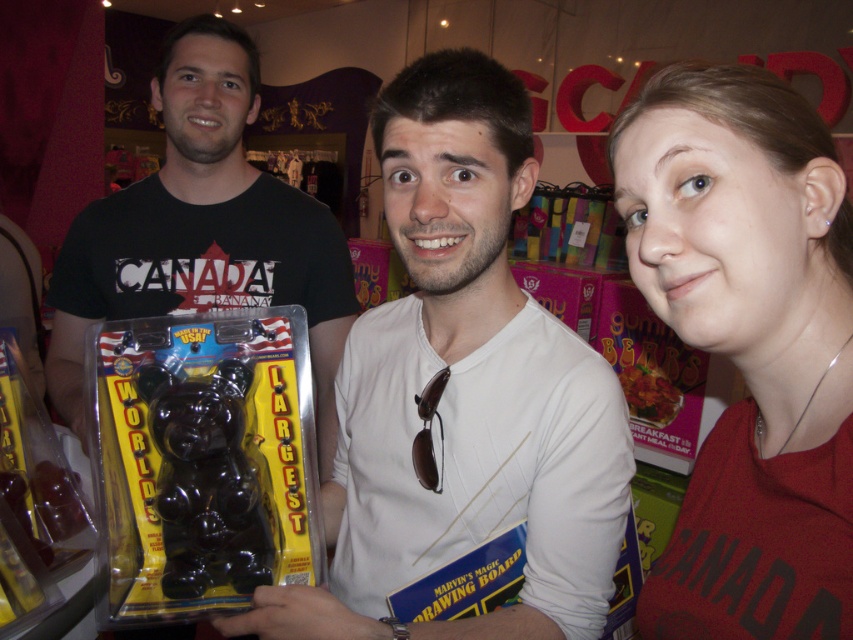
Question: Which object is the farthest from the glossy plastic bear at center?

Choices:
 (A) matte red shirt at center
 (B) black matte bear at left
 (C) matte black gummy bear at center

Answer: (A)

Question: Which point is farther from the camera taking this photo?

Choices:
 (A) (235, 428)
 (B) (445, 477)
 (C) (791, 404)

Answer: (B)

Question: Can you confirm if matte black gummy bear at center is positioned above glossy plastic bear at center?

Choices:
 (A) no
 (B) yes

Answer: (B)

Question: Can you confirm if matte black gummy bear at center is positioned to the left of glossy plastic bear at center?

Choices:
 (A) yes
 (B) no

Answer: (B)

Question: Which point is farther from the camera taking this photo?

Choices:
 (A) (216, 582)
 (B) (672, 582)

Answer: (A)

Question: Is matte red shirt at center positioned in front of black matte bear at left?

Choices:
 (A) no
 (B) yes

Answer: (B)